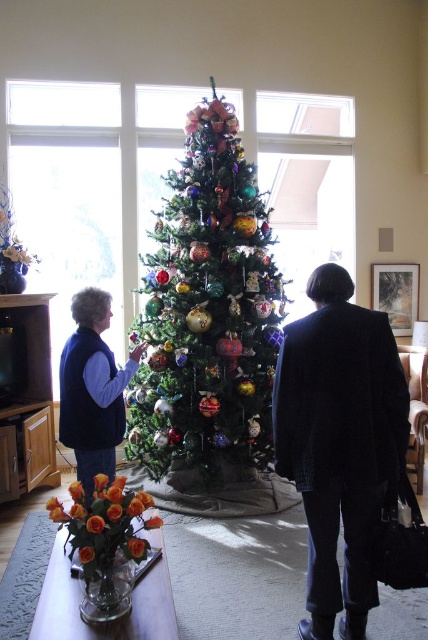
Who is positioned more to the left, green textured christmas tree at center or velvet blue vest at left?

velvet blue vest at left is more to the left.

Is green textured christmas tree at center further to the viewer compared to velvet blue vest at left?

That is True.

Where is `green textured christmas tree at center`? green textured christmas tree at center is located at coordinates (208, 314).

Does green textured christmas tree at center appear over dark wool coat at center?

Yes, green textured christmas tree at center is above dark wool coat at center.

What do you see at coordinates (208, 314) in the screenshot? This screenshot has height=640, width=428. I see `green textured christmas tree at center` at bounding box center [208, 314].

Where is `green textured christmas tree at center`? The width and height of the screenshot is (428, 640). green textured christmas tree at center is located at coordinates (208, 314).

In the scene shown: Can you confirm if dark wool coat at center is bigger than velvet blue vest at left?

No.

The image size is (428, 640). In order to click on dark wool coat at center in this screenshot , I will do `click(339, 442)`.